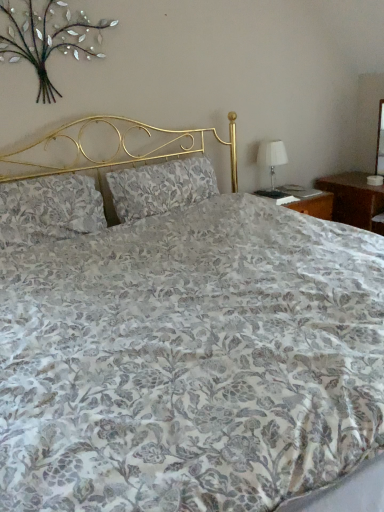
What is the approximate height of white fabric table lamp at right?

16.02 inches.

Measure the distance between point (x=133, y=212) and camera.

Point (x=133, y=212) and camera are 2.49 meters apart from each other.

Measure the distance between floral fabric pillow at center, acting as the second pillow starting from the left, and camera.

The distance of floral fabric pillow at center, acting as the second pillow starting from the left, from camera is 8.00 feet.

The width and height of the screenshot is (384, 512). In order to click on metallic silver floral arrangement at upper left in this screenshot , I will do `click(47, 41)`.

Is floral fabric pillow at center, acting as the second pillow starting from the left, bigger or smaller than floral fabric pillow at left, which is the first pillow in left-to-right order?

Considering their sizes, floral fabric pillow at center, acting as the second pillow starting from the left, takes up more space than floral fabric pillow at left, which is the first pillow in left-to-right order.

Is floral fabric pillow at center, acting as the second pillow starting from the left, facing towards floral fabric pillow at left, positioned as the second pillow in right-to-left order?

No, floral fabric pillow at center, acting as the second pillow starting from the left, is not oriented towards floral fabric pillow at left, positioned as the second pillow in right-to-left order.

Considering the relative positions of floral fabric pillow at center, the 1th pillow when ordered from right to left, and floral fabric pillow at left, which is the first pillow in left-to-right order, in the image provided, is floral fabric pillow at center, the 1th pillow when ordered from right to left, to the left or to the right of floral fabric pillow at left, which is the first pillow in left-to-right order,?

From the image, it's evident that floral fabric pillow at center, the 1th pillow when ordered from right to left, is to the right of floral fabric pillow at left, which is the first pillow in left-to-right order.

From a real-world perspective, which is physically above, floral fabric pillow at center, the 1th pillow when ordered from right to left, or floral fabric pillow at left, which is the first pillow in left-to-right order?

floral fabric pillow at left, which is the first pillow in left-to-right order.

Looking at their sizes, would you say white fabric table lamp at right is wider or thinner than metallic silver floral arrangement at upper left?

In the image, white fabric table lamp at right appears to be wider than metallic silver floral arrangement at upper left.

The height and width of the screenshot is (512, 384). What are the coordinates of `table lamp below the metallic silver floral arrangement at upper left (from the image's perspective)` in the screenshot? It's located at (272, 156).

Based on their sizes in the image, would you say white fabric table lamp at right is bigger or smaller than metallic silver floral arrangement at upper left?

Clearly, white fabric table lamp at right is larger in size than metallic silver floral arrangement at upper left.

Between white fabric table lamp at right and metallic silver floral arrangement at upper left, which one appears on the right side from the viewer's perspective?

Positioned to the right is white fabric table lamp at right.

Does white fabric table lamp at right touch floral fabric pillow at left, positioned as the second pillow in right-to-left order?

No, white fabric table lamp at right is not next to floral fabric pillow at left, positioned as the second pillow in right-to-left order.

Would you say white fabric table lamp at right contains floral fabric pillow at left, which is the first pillow in left-to-right order?

No, floral fabric pillow at left, which is the first pillow in left-to-right order, is not inside white fabric table lamp at right.

Based on the photo, which is closer, (x=275, y=144) or (x=43, y=232)?

Point (x=275, y=144) appears to be farther away from the viewer than point (x=43, y=232).

Considering the relative positions of white fabric table lamp at right and floral fabric pillow at left, positioned as the second pillow in right-to-left order, in the image provided, is white fabric table lamp at right to the left of floral fabric pillow at left, positioned as the second pillow in right-to-left order, from the viewer's perspective?

No, white fabric table lamp at right is not to the left of floral fabric pillow at left, positioned as the second pillow in right-to-left order.

Is point (153, 212) in front of point (272, 163)?

Yes, it is.

Can we say floral fabric pillow at center, acting as the second pillow starting from the left, lies outside white fabric table lamp at right?

Yes, floral fabric pillow at center, acting as the second pillow starting from the left, is located beyond the bounds of white fabric table lamp at right.

From a real-world perspective, which is physically below, floral fabric pillow at center, acting as the second pillow starting from the left, or white fabric table lamp at right?

white fabric table lamp at right is physically lower.

At what (x,y) coordinates should I click in order to perform the action: click on table lamp above the floral fabric pillow at center, the 1th pillow when ordered from right to left (from the image's perspective). Please return your answer as a coordinate pair (x, y). This screenshot has width=384, height=512. Looking at the image, I should click on (272, 156).

From the image's perspective, which pillow is the 2nd one below the metallic silver floral arrangement at upper left? Please provide its 2D coordinates.

[(49, 209)]

Which is closer to the camera, (50, 195) or (78, 40)?

Point (50, 195) is closer to the camera than point (78, 40).

Between floral fabric pillow at left, which is the first pillow in left-to-right order, and metallic silver floral arrangement at upper left, which one appears on the right side from the viewer's perspective?

Positioned to the right is metallic silver floral arrangement at upper left.

Which is behind, floral fabric pillow at left, which is the first pillow in left-to-right order, or metallic silver floral arrangement at upper left?

floral fabric pillow at left, which is the first pillow in left-to-right order, is further away from the camera.

Which of these two, metallic silver floral arrangement at upper left or white fabric table lamp at right, stands taller?

metallic silver floral arrangement at upper left.

Where is `floral arrangement lying on the left of white fabric table lamp at right`? The width and height of the screenshot is (384, 512). floral arrangement lying on the left of white fabric table lamp at right is located at coordinates (47, 41).

From the image's perspective, is metallic silver floral arrangement at upper left beneath white fabric table lamp at right?

No, from the image's perspective, metallic silver floral arrangement at upper left is not below white fabric table lamp at right.

Does metallic silver floral arrangement at upper left have a larger size compared to white fabric table lamp at right?

Incorrect, metallic silver floral arrangement at upper left is not larger than white fabric table lamp at right.

From a real-world perspective, is metallic silver floral arrangement at upper left positioned over floral fabric pillow at left, positioned as the second pillow in right-to-left order, based on gravity?

Correct, in the physical world, metallic silver floral arrangement at upper left is higher than floral fabric pillow at left, positioned as the second pillow in right-to-left order.

Is metallic silver floral arrangement at upper left shorter than floral fabric pillow at left, positioned as the second pillow in right-to-left order?

Incorrect, the height of metallic silver floral arrangement at upper left does not fall short of that of floral fabric pillow at left, positioned as the second pillow in right-to-left order.

Which is behind, point (34, 52) or point (52, 225)?

Positioned behind is point (52, 225).

Locate an element on the screen. pillow below the floral fabric pillow at left, positioned as the second pillow in right-to-left order (from a real-world perspective) is located at coordinates tap(161, 187).

Image resolution: width=384 pixels, height=512 pixels. Identify the location of floral arrangement lying in front of the white fabric table lamp at right. (47, 41).

When comparing their distances from floral fabric pillow at left, which is the first pillow in left-to-right order, does white fabric table lamp at right or metallic silver floral arrangement at upper left seem further?

white fabric table lamp at right is positioned further to the anchor floral fabric pillow at left, which is the first pillow in left-to-right order.

From the image, which object appears to be farther from floral fabric pillow at left, positioned as the second pillow in right-to-left order, metallic silver floral arrangement at upper left or floral fabric pillow at center, the 1th pillow when ordered from right to left?

Based on the image, metallic silver floral arrangement at upper left appears to be further to floral fabric pillow at left, positioned as the second pillow in right-to-left order.

Looking at the image, which one is located closer to floral fabric pillow at left, positioned as the second pillow in right-to-left order, floral fabric pillow at center, the 1th pillow when ordered from right to left, or metallic silver floral arrangement at upper left?

floral fabric pillow at center, the 1th pillow when ordered from right to left, is closer to floral fabric pillow at left, positioned as the second pillow in right-to-left order.

Based on their spatial positions, is metallic silver floral arrangement at upper left or floral fabric pillow at left, which is the first pillow in left-to-right order, further from white fabric table lamp at right?

Among the two, floral fabric pillow at left, which is the first pillow in left-to-right order, is located further to white fabric table lamp at right.

From the image, which object appears to be farther from white fabric table lamp at right, floral fabric pillow at left, positioned as the second pillow in right-to-left order, or floral fabric pillow at center, the 1th pillow when ordered from right to left?

floral fabric pillow at left, positioned as the second pillow in right-to-left order, lies further to white fabric table lamp at right than the other object.

Considering their positions, is floral fabric pillow at center, the 1th pillow when ordered from right to left, positioned further to metallic silver floral arrangement at upper left than white fabric table lamp at right?

The object further to metallic silver floral arrangement at upper left is white fabric table lamp at right.

Which object lies nearer to the anchor point metallic silver floral arrangement at upper left, floral fabric pillow at left, which is the first pillow in left-to-right order, or floral fabric pillow at center, acting as the second pillow starting from the left?

floral fabric pillow at left, which is the first pillow in left-to-right order.

When comparing their distances from metallic silver floral arrangement at upper left, does floral fabric pillow at left, positioned as the second pillow in right-to-left order, or white fabric table lamp at right seem closer?

Based on the image, floral fabric pillow at left, positioned as the second pillow in right-to-left order, appears to be nearer to metallic silver floral arrangement at upper left.

Locate an element on the screen. pillow between metallic silver floral arrangement at upper left and floral fabric pillow at left, which is the first pillow in left-to-right order, in the vertical direction is located at coordinates (161, 187).

At what (x,y) coordinates should I click in order to perform the action: click on pillow between metallic silver floral arrangement at upper left and white fabric table lamp at right in the horizontal direction. Please return your answer as a coordinate pair (x, y). The image size is (384, 512). Looking at the image, I should click on (161, 187).

The height and width of the screenshot is (512, 384). Identify the location of pillow between floral fabric pillow at left, which is the first pillow in left-to-right order, and white fabric table lamp at right from left to right. (161, 187).

This screenshot has width=384, height=512. What are the coordinates of `floral arrangement between floral fabric pillow at left, positioned as the second pillow in right-to-left order, and white fabric table lamp at right` in the screenshot? It's located at (47, 41).